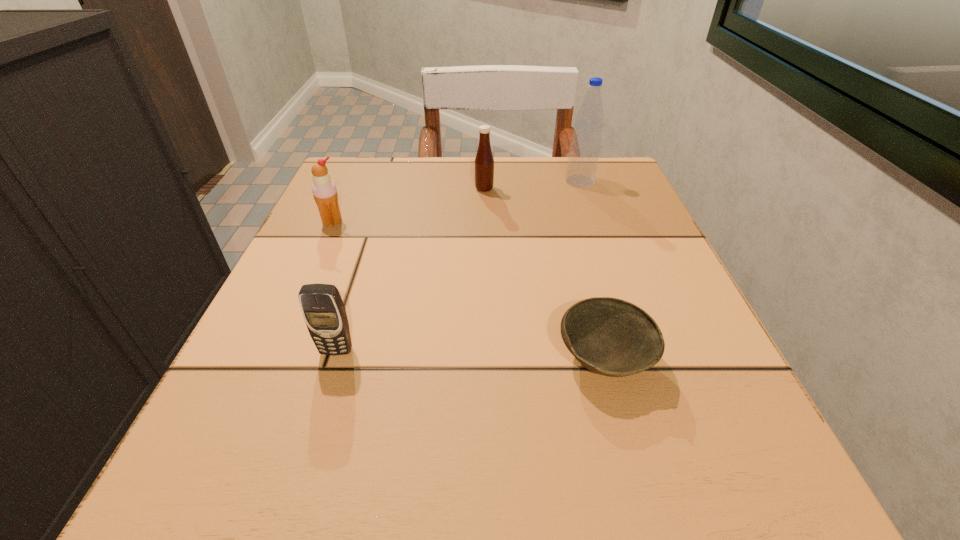
At what (x,y) coordinates should I click in order to perform the action: click on vacant area between the leftmost object and the water bottle. Please return your answer as a coordinate pair (x, y). The width and height of the screenshot is (960, 540). Looking at the image, I should click on (456, 201).

Locate an element on the screen. vacant area between the shortest object and the third object from left to right is located at coordinates (544, 274).

Locate which object is the closest to the icecream. Please provide its 2D coordinates. Your answer should be formatted as a tuple, i.e. [(x, y)], where the tuple contains the x and y coordinates of a point satisfying the conditions above.

[(484, 162)]

Locate an element on the screen. Image resolution: width=960 pixels, height=540 pixels. object that is the second closest to the third object from left to right is located at coordinates (324, 190).